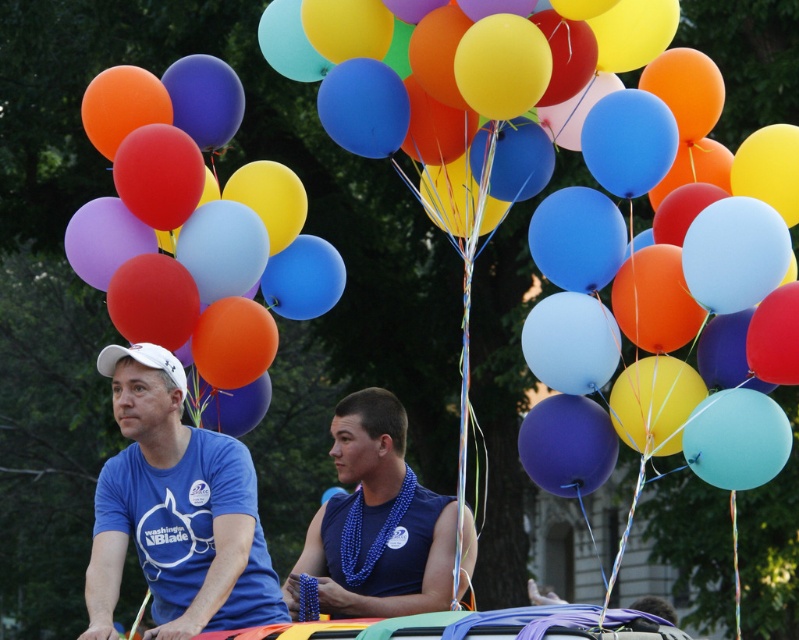
Question: Considering the relative positions of matte blue balloon at center and matte blue t-shirt at left in the image provided, where is matte blue balloon at center located with respect to matte blue t-shirt at left?

Choices:
 (A) left
 (B) right

Answer: (B)

Question: Which of the following is the closest to the observer?

Choices:
 (A) matte blue t-shirt at left
 (B) matte blue balloon at center

Answer: (A)

Question: Does matte blue balloon at center appear under blue beaded necklace at center?

Choices:
 (A) no
 (B) yes

Answer: (A)

Question: From the image, what is the correct spatial relationship of matte blue t-shirt at left in relation to blue beaded necklace at center?

Choices:
 (A) right
 (B) left

Answer: (B)

Question: Which is nearer to the matte blue balloon at center?

Choices:
 (A) blue beaded necklace at center
 (B) matte blue t-shirt at left

Answer: (B)

Question: Among these objects, which one is farthest from the camera?

Choices:
 (A) matte blue balloon at center
 (B) blue beaded necklace at center

Answer: (B)